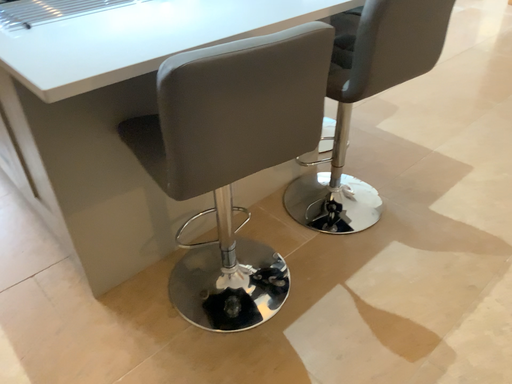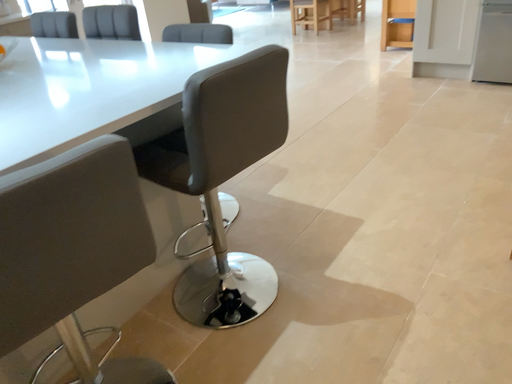
Question: How did the camera likely rotate when shooting the video?

Choices:
 (A) rotated left
 (B) rotated right

Answer: (B)